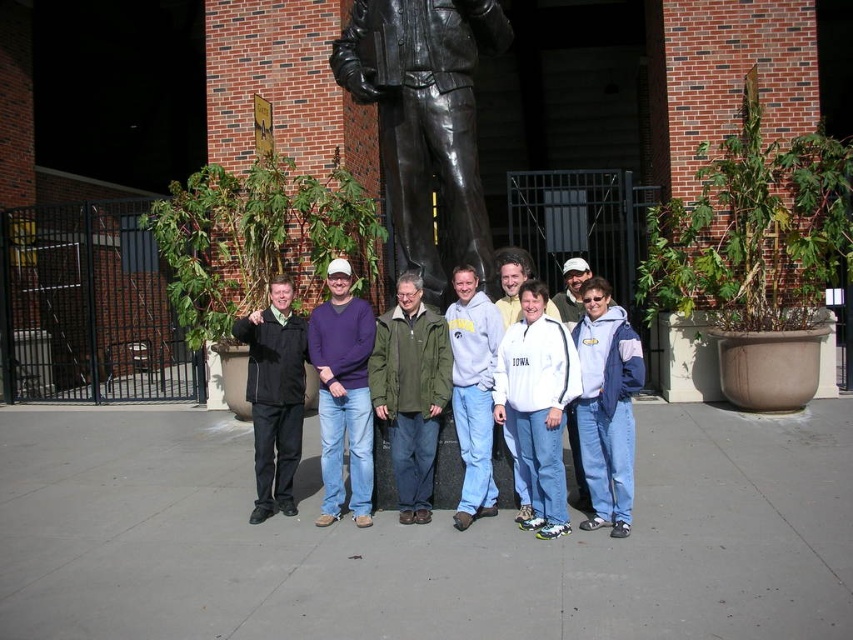
How distant is purple sweater at center from black matte jacket at center?

purple sweater at center and black matte jacket at center are 16.36 inches apart.

Between purple sweater at center and black matte jacket at center, which one has more height?

With more height is purple sweater at center.

Is point (329, 394) closer to camera compared to point (282, 320)?

Yes, it is.

At what (x,y) coordinates should I click in order to perform the action: click on purple sweater at center. Please return your answer as a coordinate pair (x, y). This screenshot has width=853, height=640. Looking at the image, I should click on (343, 394).

Between bronze statue at center and purple sweater at center, which one has less height?

purple sweater at center is shorter.

Image resolution: width=853 pixels, height=640 pixels. I want to click on bronze statue at center, so click(x=424, y=116).

In order to click on bronze statue at center in this screenshot , I will do click(424, 116).

Does white fleece jacket at center appear under white matte jacket at center?

Indeed, white fleece jacket at center is positioned under white matte jacket at center.

Does white fleece jacket at center have a smaller size compared to white matte jacket at center?

No.

Does point (616, 440) come closer to viewer compared to point (506, 435)?

Yes, point (616, 440) is in front of point (506, 435).

At what (x,y) coordinates should I click in order to perform the action: click on white fleece jacket at center. Please return your answer as a coordinate pair (x, y). Looking at the image, I should click on (606, 406).